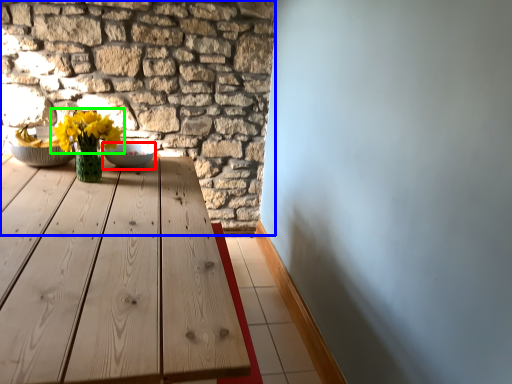
Question: Which object is positioned closest to bowl (highlighted by a red box)? Select from brickwork (highlighted by a blue box) and flower (highlighted by a green box).

Choices:
 (A) brickwork
 (B) flower

Answer: (B)